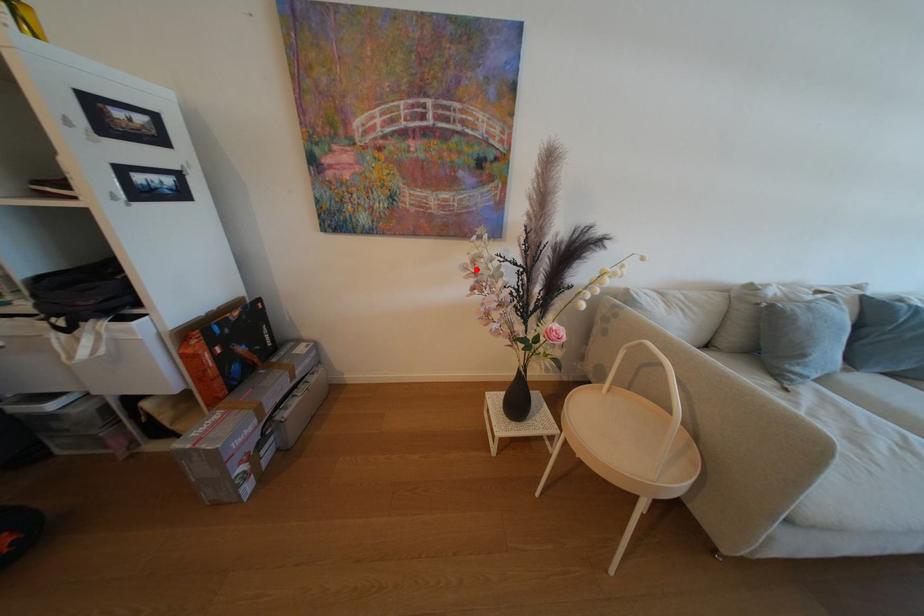
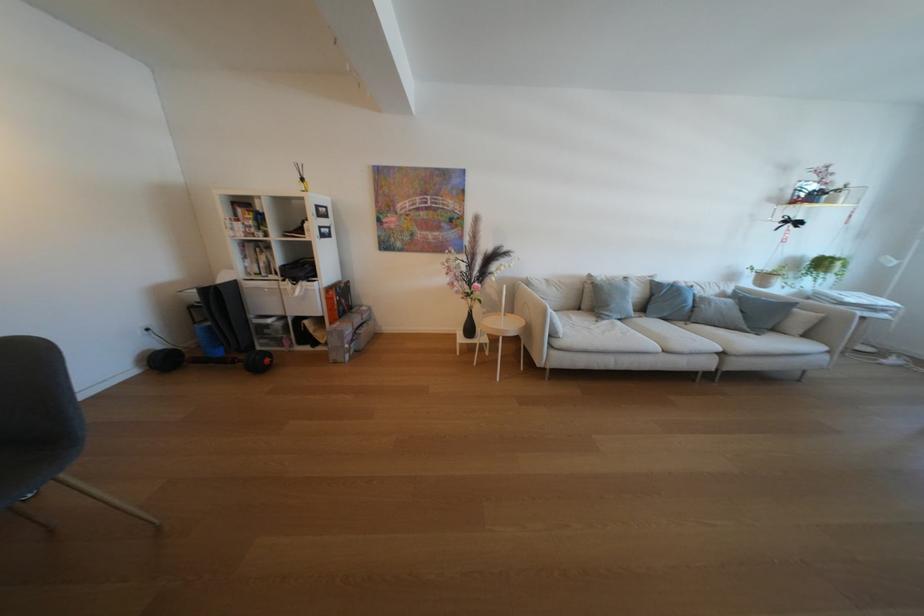
In the second image, find the point that corresponds to the highlighted location in the first image.

(455, 265)